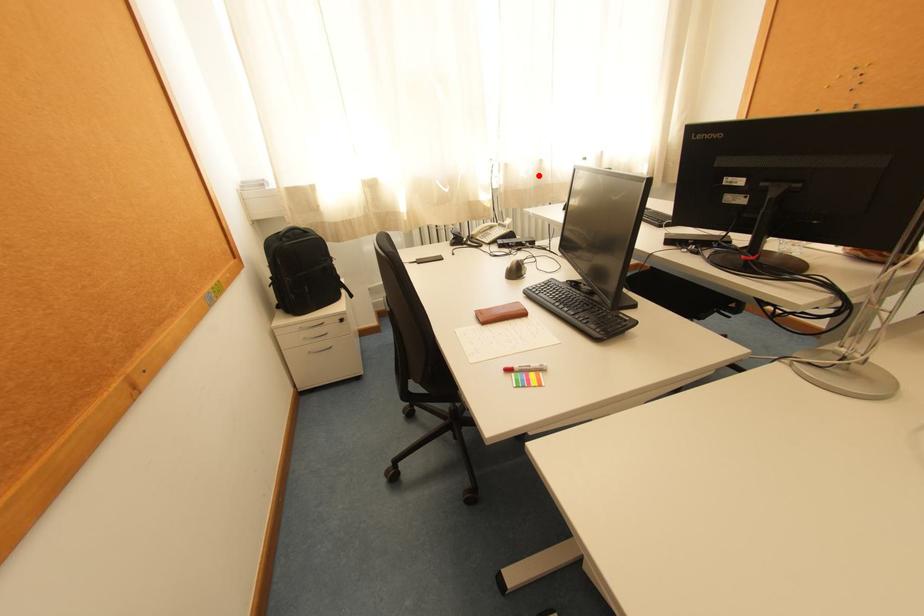
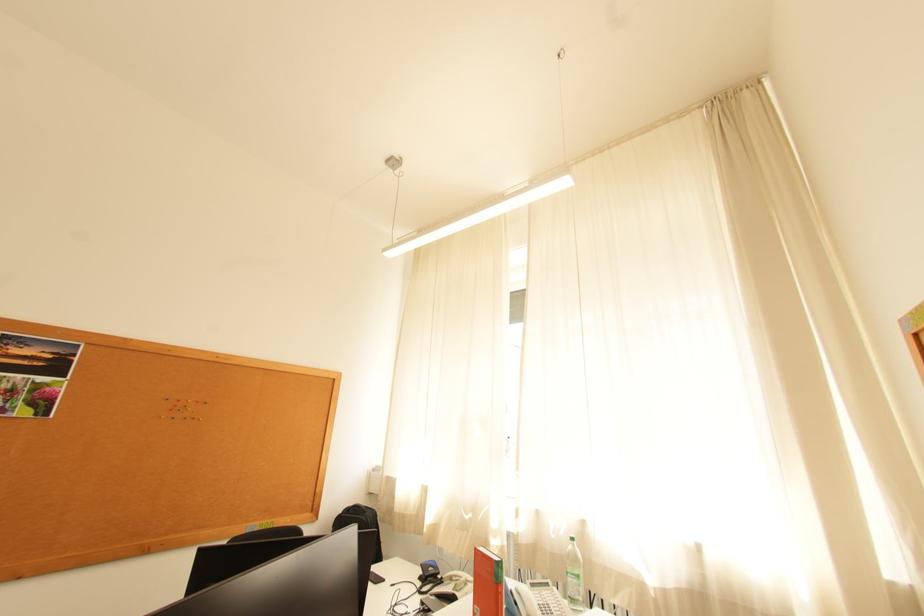
The point at the highlighted location is marked in the first image. Where is the corresponding point in the second image?

(569, 536)